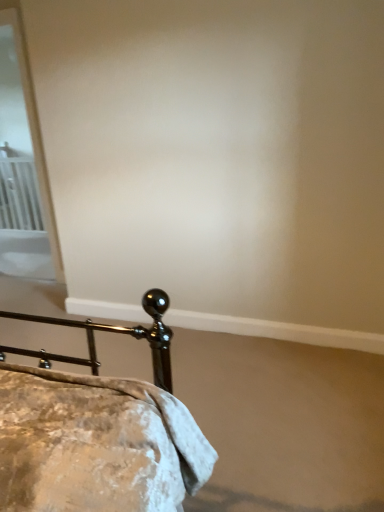
At what (x,y) coordinates should I click in order to perform the action: click on white metal radiator at left. Please return your answer as a coordinate pair (x, y). Image resolution: width=384 pixels, height=512 pixels. Looking at the image, I should click on (19, 195).

Find the location of a particular element. white metal radiator at left is located at coordinates (19, 195).

Is metallic gold bed at lower left at the back of white metal radiator at left?

white metal radiator at left does not have its back to metallic gold bed at lower left.

From a real-world perspective, which is physically below, white metal radiator at left or metallic gold bed at lower left?

metallic gold bed at lower left.

What's the angular difference between white metal radiator at left and metallic gold bed at lower left's facing directions?

There is a 180-degree angle between the facing directions of white metal radiator at left and metallic gold bed at lower left.

Looking at the image, does white glossy screen door at upper left seem bigger or smaller compared to metallic gold bed at lower left?

Clearly, white glossy screen door at upper left is smaller in size than metallic gold bed at lower left.

Find the location of a particular element. The image size is (384, 512). screen door located on the left of metallic gold bed at lower left is located at coordinates (34, 127).

Between white glossy screen door at upper left and metallic gold bed at lower left, which one has smaller width?

white glossy screen door at upper left is thinner.

Is white glossy screen door at upper left taller or shorter than metallic gold bed at lower left?

white glossy screen door at upper left is taller than metallic gold bed at lower left.

The image size is (384, 512). I want to click on screen door above the metallic gold bed at lower left (from a real-world perspective), so click(34, 127).

Can you tell me how much metallic gold bed at lower left and white glossy screen door at upper left differ in facing direction?

metallic gold bed at lower left and white glossy screen door at upper left are facing 180 degrees away from each other.

Could you tell me if metallic gold bed at lower left is facing white glossy screen door at upper left?

No, metallic gold bed at lower left is not facing towards white glossy screen door at upper left.

Consider the image. Considering the positions of objects metallic gold bed at lower left and white glossy screen door at upper left in the image provided, who is behind, metallic gold bed at lower left or white glossy screen door at upper left?

Positioned behind is white glossy screen door at upper left.

How much distance is there between metallic gold bed at lower left and white metal radiator at left?

metallic gold bed at lower left and white metal radiator at left are 3.68 meters apart.

From the picture: Which is more to the right, metallic gold bed at lower left or white metal radiator at left?

From the viewer's perspective, metallic gold bed at lower left appears more on the right side.

Does metallic gold bed at lower left lie in front of white metal radiator at left?

Yes, metallic gold bed at lower left is closer to the viewer.

In the scene shown: Which of these two, metallic gold bed at lower left or white metal radiator at left, is wider?

metallic gold bed at lower left is wider.

Considering the relative sizes of white metal radiator at left and white glossy screen door at upper left in the image provided, is white metal radiator at left bigger than white glossy screen door at upper left?

Actually, white metal radiator at left might be smaller than white glossy screen door at upper left.

Which is more to the right, white metal radiator at left or white glossy screen door at upper left?

white glossy screen door at upper left is more to the right.

Is point (3, 183) behind point (0, 14)?

Yes, it is.

In terms of height, does white metal radiator at left look taller or shorter compared to white glossy screen door at upper left?

In the image, white metal radiator at left appears to be shorter than white glossy screen door at upper left.

Can you confirm if white glossy screen door at upper left is thinner than white metal radiator at left?

No, white glossy screen door at upper left is not thinner than white metal radiator at left.

From a real-world perspective, is white glossy screen door at upper left located beneath white metal radiator at left?

No, from a real-world perspective, white glossy screen door at upper left is not beneath white metal radiator at left.

Is point (9, 0) positioned before point (18, 163)?

Yes, it is in front of point (18, 163).

Where is `radiator to the left of white glossy screen door at upper left`? This screenshot has width=384, height=512. radiator to the left of white glossy screen door at upper left is located at coordinates (19, 195).

This screenshot has height=512, width=384. Find the location of `radiator behind the metallic gold bed at lower left`. radiator behind the metallic gold bed at lower left is located at coordinates (x=19, y=195).

Locate an element on the screen. This screenshot has width=384, height=512. bed that is on the right side of white glossy screen door at upper left is located at coordinates (95, 443).

When comparing their distances from metallic gold bed at lower left, does white metal radiator at left or white glossy screen door at upper left seem closer?

Among the two, white glossy screen door at upper left is located nearer to metallic gold bed at lower left.

Considering their positions, is white metal radiator at left positioned further to white glossy screen door at upper left than metallic gold bed at lower left?

metallic gold bed at lower left.

Based on their spatial positions, is metallic gold bed at lower left or white glossy screen door at upper left further from white metal radiator at left?

metallic gold bed at lower left.

Looking at the image, which one is located further to metallic gold bed at lower left, white glossy screen door at upper left or white metal radiator at left?

white metal radiator at left.

Based on their spatial positions, is white glossy screen door at upper left or metallic gold bed at lower left closer to white metal radiator at left?

white glossy screen door at upper left is positioned closer to the anchor white metal radiator at left.

Considering their positions, is metallic gold bed at lower left positioned further to white glossy screen door at upper left than white metal radiator at left?

Based on the image, metallic gold bed at lower left appears to be further to white glossy screen door at upper left.

Locate an element on the screen. screen door between metallic gold bed at lower left and white metal radiator at left in the front-back direction is located at coordinates (34, 127).